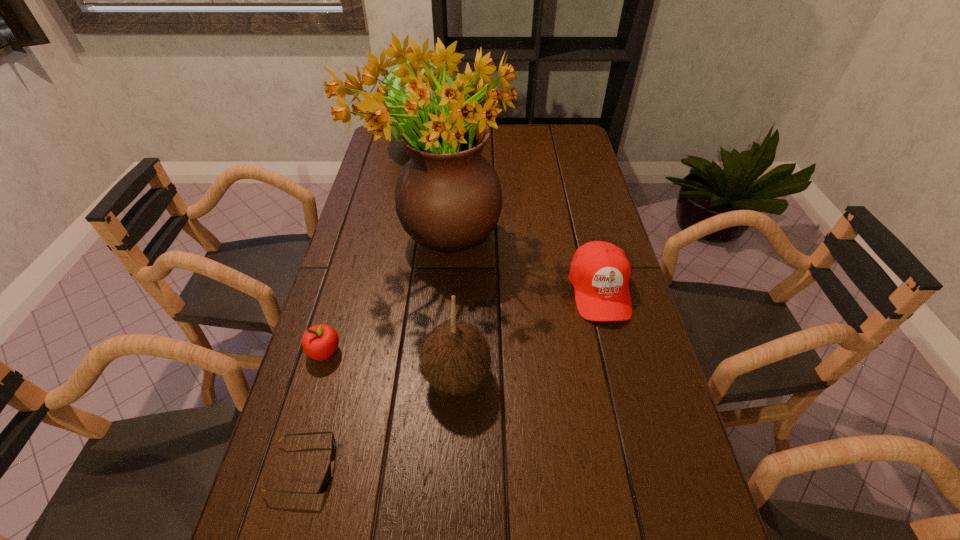
Where is `flower arrangement`? flower arrangement is located at coordinates (448, 197).

This screenshot has height=540, width=960. Find the location of `the farthest object`. the farthest object is located at coordinates (395, 81).

The width and height of the screenshot is (960, 540). I want to click on the fifth shortest object, so (x=395, y=81).

You are a GUI agent. You are given a task and a screenshot of the screen. Output one action in this format:
    pyautogui.click(x=<x>, y=<y>)
    Task: Click on the fourth shortest object
    
    Given the screenshot: What is the action you would take?
    pyautogui.click(x=455, y=358)

Locate an element on the screen. The width and height of the screenshot is (960, 540). the rightmost object is located at coordinates (600, 271).

In order to click on baseball cap in this screenshot , I will do `click(600, 271)`.

You are a GUI agent. You are given a task and a screenshot of the screen. Output one action in this format:
    pyautogui.click(x=<x>, y=<y>)
    Task: Click on the second shortest object
    
    Given the screenshot: What is the action you would take?
    point(320,342)

Where is `the shortest object`? The image size is (960, 540). the shortest object is located at coordinates (325, 482).

This screenshot has width=960, height=540. Identify the location of sunglasses. (325, 482).

Find the location of a particular element. The height and width of the screenshot is (540, 960). vacant region located 0.360m on the front of the tallest object is located at coordinates (420, 417).